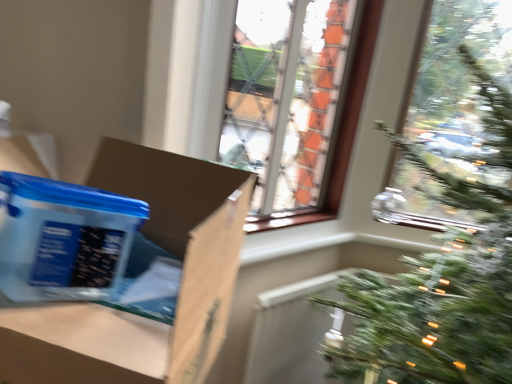
Question: Relative to matte brown cardboard at left, positioned as the 1th cardboard box in front-to-back order, is translucent plastic container at left, the first cardboard box viewed from the back, in front or behind?

Choices:
 (A) front
 (B) behind

Answer: (B)

Question: Does point (74, 213) appear closer or farther from the camera than point (219, 185)?

Choices:
 (A) closer
 (B) farther

Answer: (A)

Question: Looking at their shapes, would you say translucent plastic container at left, the first cardboard box viewed from the back, is wider or thinner than matte brown cardboard at left, positioned as the 1th cardboard box in front-to-back order?

Choices:
 (A) wide
 (B) thin

Answer: (B)

Question: Considering the relative positions of matte brown cardboard at left, positioned as the 1th cardboard box in front-to-back order, and translucent plastic container at left, the first cardboard box viewed from the back, in the image provided, is matte brown cardboard at left, positioned as the 1th cardboard box in front-to-back order, to the left or to the right of translucent plastic container at left, the first cardboard box viewed from the back,?

Choices:
 (A) left
 (B) right

Answer: (B)

Question: Relative to translucent plastic container at left, placed as the 2th cardboard box when sorted from front to back, is matte brown cardboard at left, marked as the second cardboard box in a back-to-front arrangement, in front or behind?

Choices:
 (A) behind
 (B) front

Answer: (B)

Question: Does point (219, 205) appear closer or farther from the camera than point (80, 284)?

Choices:
 (A) closer
 (B) farther

Answer: (A)

Question: Is matte brown cardboard at left, marked as the second cardboard box in a back-to-front arrangement, situated inside translucent plastic container at left, placed as the 2th cardboard box when sorted from front to back, or outside?

Choices:
 (A) outside
 (B) inside

Answer: (A)